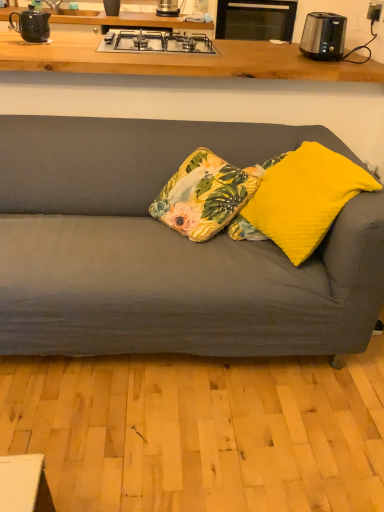
Question: Considering the relative sizes of floral fabric cushion at center, the third pillow positioned from the right, and satin silver toaster at upper center, which is the 1th kitchen appliance from top to bottom, in the image provided, is floral fabric cushion at center, the third pillow positioned from the right, thinner than satin silver toaster at upper center, which is the 1th kitchen appliance from top to bottom,?

Choices:
 (A) no
 (B) yes

Answer: (A)

Question: Does floral fabric cushion at center, the third pillow positioned from the right, lie in front of satin silver toaster at upper center, the first kitchen appliance from the back?

Choices:
 (A) no
 (B) yes

Answer: (B)

Question: Is floral fabric cushion at center, which ranks as the first pillow in left-to-right order, wider than satin silver toaster at upper center, which is the 1th kitchen appliance from top to bottom?

Choices:
 (A) yes
 (B) no

Answer: (A)

Question: Is satin silver toaster at upper center, which ranks as the 2th kitchen appliance in right-to-left order, inside floral fabric cushion at center, the third pillow positioned from the right?

Choices:
 (A) yes
 (B) no

Answer: (B)

Question: Is floral fabric cushion at center, the third pillow positioned from the right, with satin silver toaster at upper center, the first kitchen appliance from the back?

Choices:
 (A) no
 (B) yes

Answer: (A)

Question: Is floral fabric cushion at center, which ranks as the first pillow in left-to-right order, looking in the opposite direction of satin silver toaster at upper center, which is the 1th kitchen appliance from left to right?

Choices:
 (A) no
 (B) yes

Answer: (A)

Question: Considering the relative sizes of matte black teapot at upper left and silver metallic gas stove at upper center in the image provided, is matte black teapot at upper left smaller than silver metallic gas stove at upper center?

Choices:
 (A) yes
 (B) no

Answer: (A)

Question: Does matte black teapot at upper left lie behind silver metallic gas stove at upper center?

Choices:
 (A) yes
 (B) no

Answer: (A)

Question: Is matte black teapot at upper left positioned beyond the bounds of silver metallic gas stove at upper center?

Choices:
 (A) yes
 (B) no

Answer: (A)

Question: Is matte black teapot at upper left to the left of silver metallic gas stove at upper center from the viewer's perspective?

Choices:
 (A) no
 (B) yes

Answer: (B)

Question: Is matte black teapot at upper left facing away from silver metallic gas stove at upper center?

Choices:
 (A) no
 (B) yes

Answer: (A)

Question: Does matte black teapot at upper left have a larger size compared to silver metallic gas stove at upper center?

Choices:
 (A) no
 (B) yes

Answer: (A)

Question: Does floral fabric cushion at center, the third pillow positioned from the right, have a smaller size compared to yellow fabric pillow at center, which is the second pillow from left to right?

Choices:
 (A) yes
 (B) no

Answer: (B)